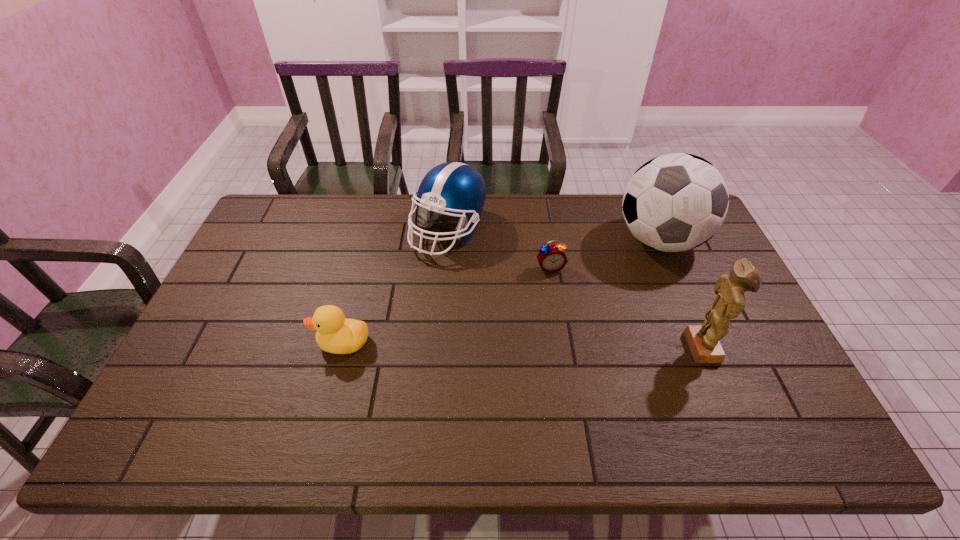
The image size is (960, 540). What are the coordinates of `duck` in the screenshot? It's located at (336, 334).

You are a GUI agent. You are given a task and a screenshot of the screen. Output one action in this format:
    pyautogui.click(x=<x>, y=<y>)
    Task: Click on the figurine
    This screenshot has height=540, width=960.
    Given the screenshot: What is the action you would take?
    pyautogui.click(x=703, y=340)

This screenshot has height=540, width=960. I want to click on soccer ball, so click(675, 202).

I want to click on the third object from left to right, so click(551, 258).

The width and height of the screenshot is (960, 540). I want to click on football helmet, so click(453, 188).

Where is `the third shortest object`? This screenshot has width=960, height=540. the third shortest object is located at coordinates (453, 188).

The width and height of the screenshot is (960, 540). I want to click on vacant space located at the beak of the leftmost object, so click(298, 342).

Locate an element on the screen. vacant area located 0.260m at the beak of the leftmost object is located at coordinates (219, 342).

This screenshot has width=960, height=540. In order to click on vacant space located 0.250m at the beak of the leftmost object in this screenshot , I will do `click(223, 342)`.

Identify the location of vacant space located 0.090m on the front-facing side of the figurine. Image resolution: width=960 pixels, height=540 pixels. (755, 347).